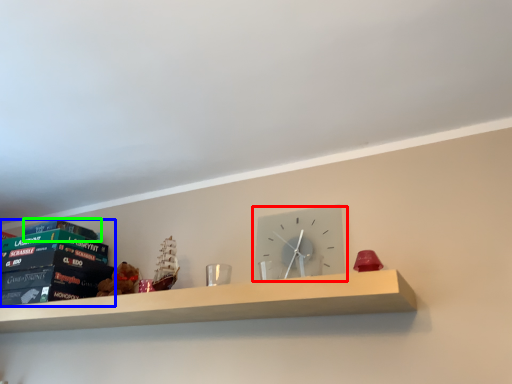
Question: Based on their relative distances, which object is nearer to wall clock (highlighted by a red box)? Choose from paperback book (highlighted by a blue box) and paperback book (highlighted by a green box).

Choices:
 (A) paperback book
 (B) paperback book

Answer: (A)